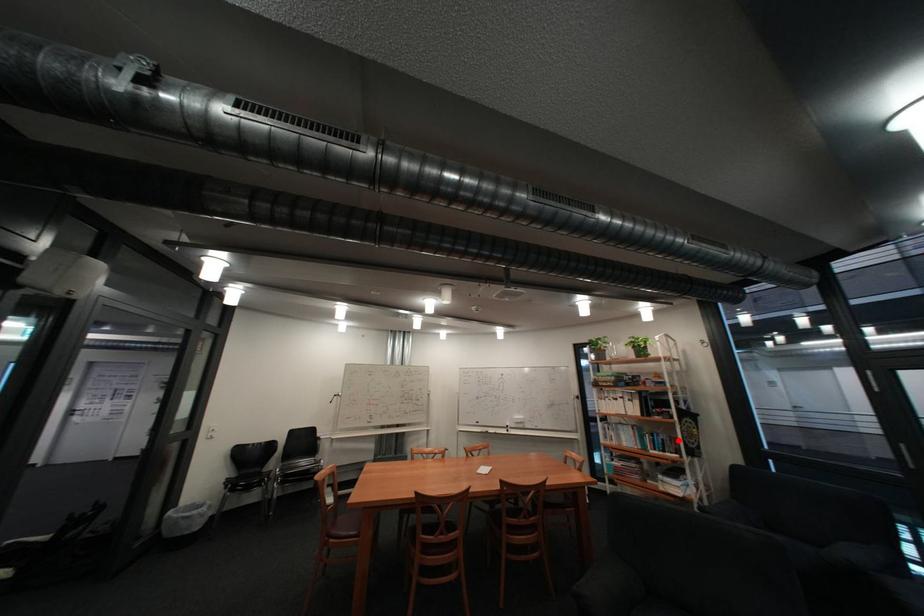
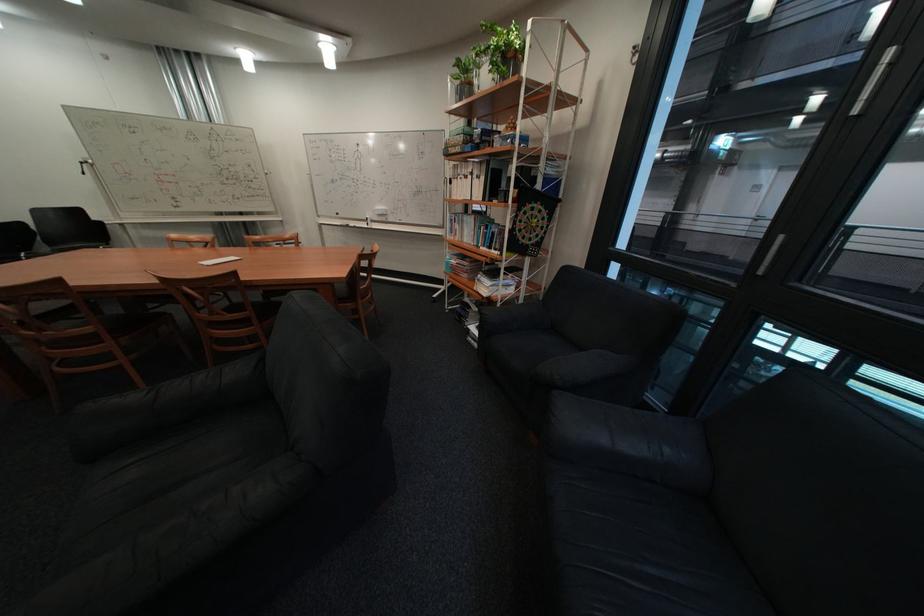
Find the pixel in the second image that matches the highlighted location in the first image.

(508, 233)